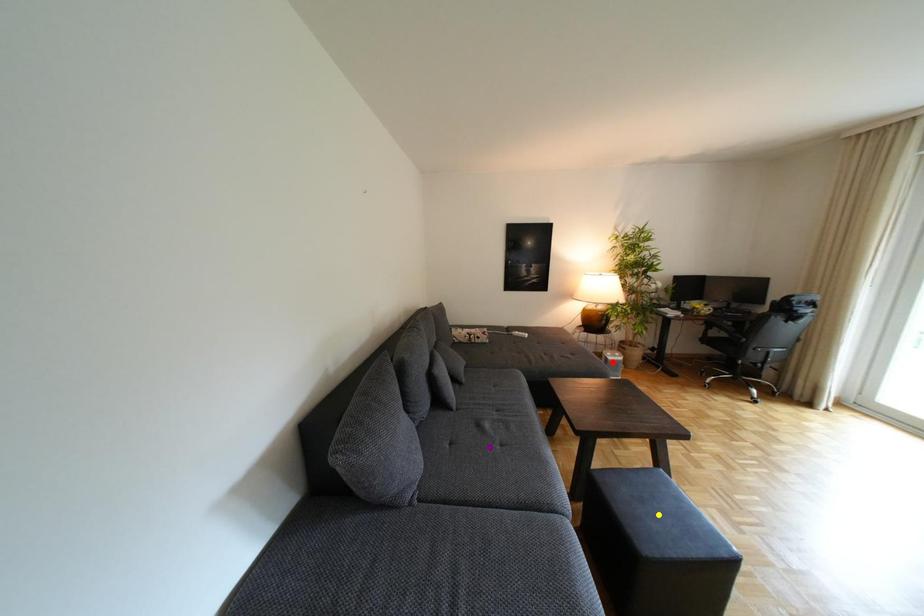
Order these from nearest to farthest:
purple point
yellow point
red point

yellow point, purple point, red point